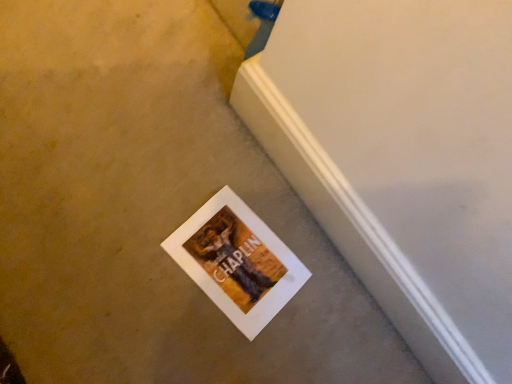
What are the coordinates of `vacant space in front of white matte picture frame at lower center` in the screenshot? It's located at (159, 322).